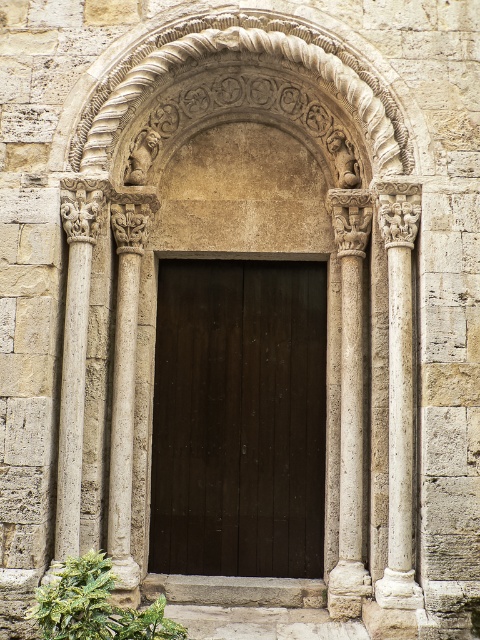
Question: Which point is closer to the camera?

Choices:
 (A) (284, 38)
 (B) (417, 600)

Answer: (B)

Question: Is white stone column at right bigger than smooth stone column at left?

Choices:
 (A) yes
 (B) no

Answer: (B)

Question: Which object is positioned closest to the dark wood door at center?

Choices:
 (A) white stone column at right
 (B) smooth stone column at left

Answer: (A)

Question: Does dark wood door at center appear on the right side of smooth stone column at left?

Choices:
 (A) yes
 (B) no

Answer: (A)

Question: Which point is closer to the camera?

Choices:
 (A) (x=123, y=60)
 (B) (x=72, y=547)
 (C) (x=392, y=564)

Answer: (C)

Question: Is dark wood door at center behind smooth stone column at left?

Choices:
 (A) yes
 (B) no

Answer: (A)